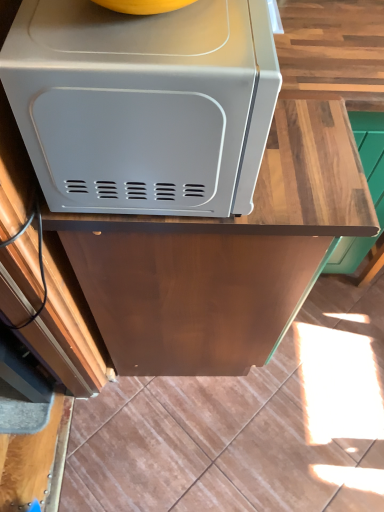
Question: From a real-world perspective, is wooden at upper center physically located above or below satin white microwave at upper left?

Choices:
 (A) above
 (B) below

Answer: (B)

Question: Considering the positions of wooden at upper center and satin white microwave at upper left in the image, is wooden at upper center bigger or smaller than satin white microwave at upper left?

Choices:
 (A) small
 (B) big

Answer: (B)

Question: From the image's perspective, relative to satin white microwave at upper left, is wooden at upper center above or below?

Choices:
 (A) below
 (B) above

Answer: (A)

Question: Is point (34, 4) positioned closer to the camera than point (304, 222)?

Choices:
 (A) farther
 (B) closer

Answer: (B)

Question: Considering the positions of satin white microwave at upper left and wooden at upper center in the image, is satin white microwave at upper left wider or thinner than wooden at upper center?

Choices:
 (A) wide
 (B) thin

Answer: (B)

Question: From a real-world perspective, is satin white microwave at upper left positioned above or below wooden at upper center?

Choices:
 (A) above
 (B) below

Answer: (A)

Question: Considering the relative positions of satin white microwave at upper left and wooden at upper center in the image provided, is satin white microwave at upper left to the left or to the right of wooden at upper center?

Choices:
 (A) left
 (B) right

Answer: (A)